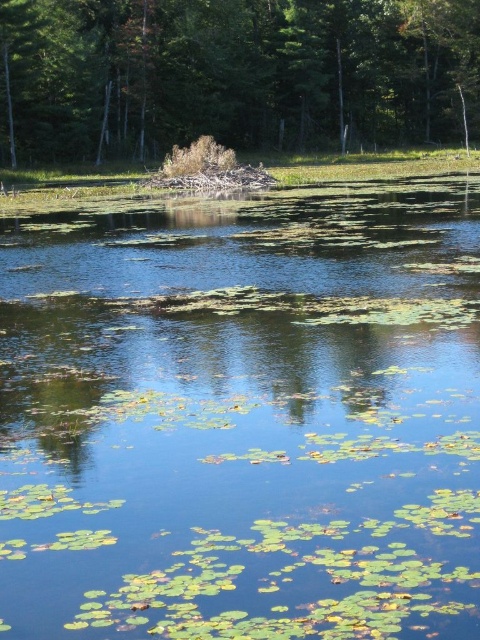
Image resolution: width=480 pixels, height=640 pixels. Find the location of `green leafy water at center`. green leafy water at center is located at coordinates (241, 413).

Does point (222, 497) come in front of point (204, 67)?

That is True.

What do you see at coordinates (241, 413) in the screenshot?
I see `green leafy water at center` at bounding box center [241, 413].

Locate an element on the screen. green leafy water at center is located at coordinates (241, 413).